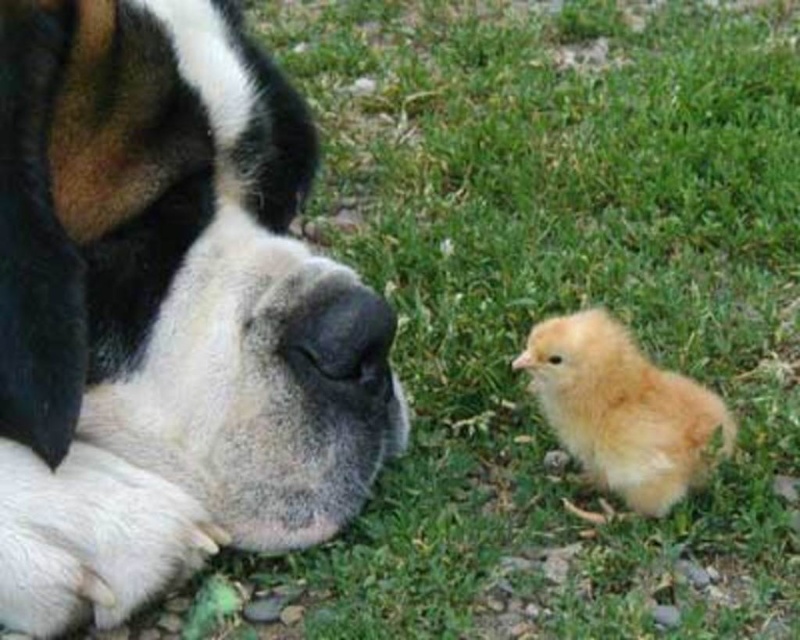
Is point (584, 353) positioned behind point (380, 298)?

No, it is not.

Which is below, golden fluffy chick at lower right or black matte nose at lower center?

golden fluffy chick at lower right

Between point (724, 416) and point (322, 314), which one is positioned in front?

Positioned in front is point (322, 314).

At what (x,y) coordinates should I click in order to perform the action: click on golden fluffy chick at lower right. Please return your answer as a coordinate pair (x, y). Image resolution: width=800 pixels, height=640 pixels. Looking at the image, I should click on (625, 412).

Is white fur dog at center shorter than soft yellow down at lower right?

No, white fur dog at center is not shorter than soft yellow down at lower right.

Measure the distance between white fur dog at center and soft yellow down at lower right.

white fur dog at center is 45.56 centimeters from soft yellow down at lower right.

You are a GUI agent. You are given a task and a screenshot of the screen. Output one action in this format:
    pyautogui.click(x=<x>, y=<y>)
    Task: Click on the white fur dog at center
    Image resolution: width=800 pixels, height=640 pixels.
    Given the screenshot: What is the action you would take?
    pyautogui.click(x=158, y=310)

Consider the image. Measure the distance from golden fluffy chick at lower right to soft yellow down at lower right.

The distance of golden fluffy chick at lower right from soft yellow down at lower right is 5.95 inches.

The image size is (800, 640). What do you see at coordinates (625, 412) in the screenshot? I see `golden fluffy chick at lower right` at bounding box center [625, 412].

The height and width of the screenshot is (640, 800). I want to click on golden fluffy chick at lower right, so click(x=625, y=412).